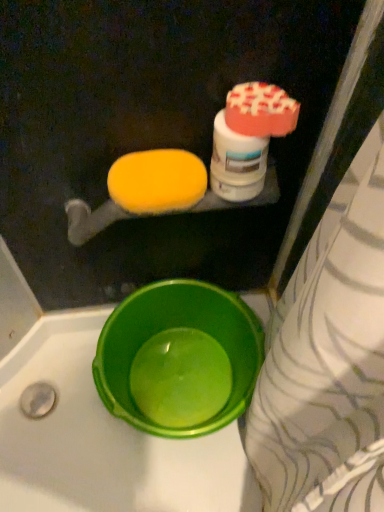
Question: Is white glossy bottle at upper right inside the boundaries of green plastic basin at lower left, or outside?

Choices:
 (A) inside
 (B) outside

Answer: (B)

Question: Is white glossy bottle at upper right in front of or behind green plastic basin at lower left in the image?

Choices:
 (A) behind
 (B) front

Answer: (B)

Question: Which object is the closest to the green plastic basin at lower left?

Choices:
 (A) white glossy bottle at upper right
 (B) yellow sponge at upper left

Answer: (B)

Question: Considering the real-world distances, which object is farthest from the white glossy bottle at upper right?

Choices:
 (A) green plastic basin at lower left
 (B) yellow sponge at upper left

Answer: (A)